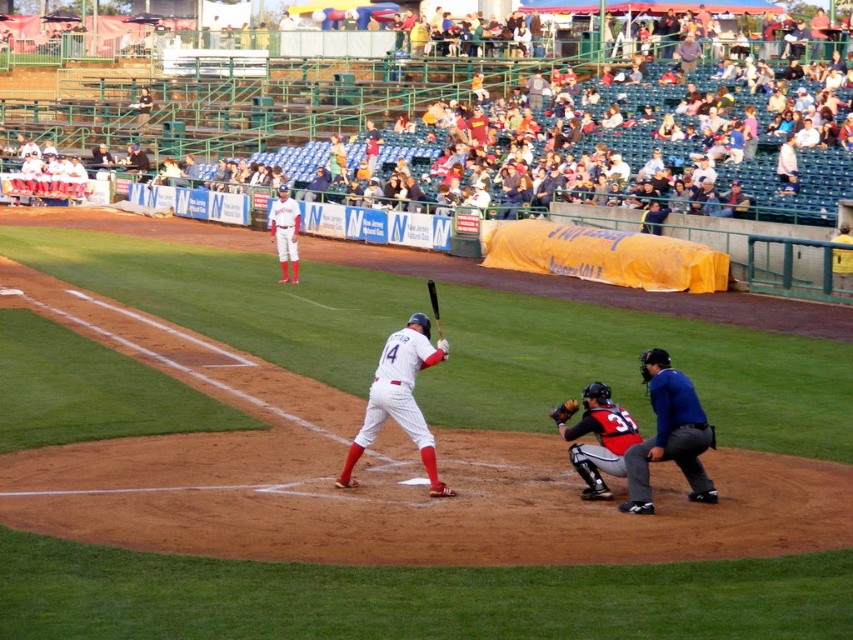
Is white plastic seats at upper center bigger than black leather catcher at lower right?

Yes, white plastic seats at upper center is bigger than black leather catcher at lower right.

Does point (769, 176) come farther from viewer compared to point (624, 468)?

Yes, point (769, 176) is farther from viewer.

Which is in front, point (231, 148) or point (575, 410)?

Point (575, 410) is more forward.

You are a GUI agent. You are given a task and a screenshot of the screen. Output one action in this format:
    pyautogui.click(x=<x>, y=<y>)
    Task: Click on the white plastic seats at upper center
    This screenshot has width=853, height=640.
    Given the screenshot: What is the action you would take?
    pyautogui.click(x=482, y=109)

Measure the distance between white matte baseball bat at center and camera.

white matte baseball bat at center and camera are 11.88 meters apart from each other.

Can you confirm if white matte baseball bat at center is positioned below orange leather glove at lower center?

Incorrect, white matte baseball bat at center is not positioned below orange leather glove at lower center.

Where is `white matte baseball bat at center`? The width and height of the screenshot is (853, 640). white matte baseball bat at center is located at coordinates (399, 397).

Image resolution: width=853 pixels, height=640 pixels. Find the location of `white matte baseball bat at center`. white matte baseball bat at center is located at coordinates (399, 397).

Is orange leather glove at lower center behind black matte bat at center?

Yes.

This screenshot has height=640, width=853. I want to click on orange leather glove at lower center, so click(x=563, y=410).

Does point (558, 419) lie behind point (436, 305)?

No, (558, 419) is closer to viewer.

Image resolution: width=853 pixels, height=640 pixels. Identify the location of orange leather glove at lower center. (563, 410).